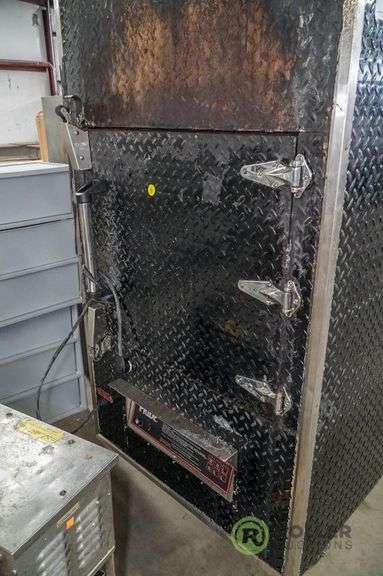
Identify the location of boxes. (78, 380), (50, 226), (71, 369), (47, 329), (60, 250), (58, 207).